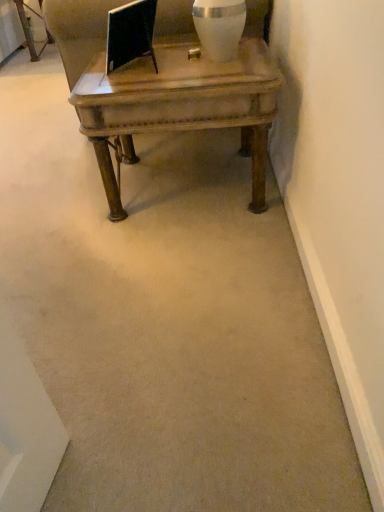
Find the location of `wooden coffee table at center`. wooden coffee table at center is located at coordinates (180, 105).

Describe the element at coordinates (180, 105) in the screenshot. I see `wooden coffee table at center` at that location.

Measure the distance between wooden coffee table at center and camera.

wooden coffee table at center is 1.33 meters away from camera.

The image size is (384, 512). Describe the element at coordinates (219, 27) in the screenshot. I see `white glossy vase at upper center` at that location.

The height and width of the screenshot is (512, 384). I want to click on white glossy vase at upper center, so click(219, 27).

Find the location of a particular element. Image resolution: width=384 pixels, height=512 pixels. wooden coffee table at center is located at coordinates (180, 105).

Visually, is white glossy vase at upper center positioned to the left or to the right of wooden coffee table at center?

Based on their positions, white glossy vase at upper center is located to the right of wooden coffee table at center.

Between white glossy vase at upper center and wooden coffee table at center, which one is positioned in front?

wooden coffee table at center is more forward.

Which is in front, point (208, 6) or point (179, 54)?

The point (208, 6) is in front.

From the picture: From the image's perspective, is white glossy vase at upper center over wooden coffee table at center?

Yes, from the image's perspective, white glossy vase at upper center is above wooden coffee table at center.

From a real-world perspective, is white glossy vase at upper center located beneath wooden coffee table at center?

Actually, white glossy vase at upper center is physically above wooden coffee table at center in the real world.

Is white glossy vase at upper center wider or thinner than wooden coffee table at center?

Considering their sizes, white glossy vase at upper center looks slimmer than wooden coffee table at center.

Who is taller, white glossy vase at upper center or wooden coffee table at center?

Standing taller between the two is wooden coffee table at center.

Between white glossy vase at upper center and wooden coffee table at center, which one has smaller size?

With smaller size is white glossy vase at upper center.

Is white glossy vase at upper center spatially inside wooden coffee table at center, or outside of it?

white glossy vase at upper center is located beyond the bounds of wooden coffee table at center.

Is white glossy vase at upper center next to wooden coffee table at center?

white glossy vase at upper center and wooden coffee table at center are not in contact.

Looking at this image, is white glossy vase at upper center oriented towards wooden coffee table at center?

No, white glossy vase at upper center is not oriented towards wooden coffee table at center.

Locate an element on the screen. vase behind the wooden coffee table at center is located at coordinates (219, 27).

Is wooden coffee table at center to the left of white glossy vase at upper center from the viewer's perspective?

Yes, wooden coffee table at center is to the left of white glossy vase at upper center.

Considering the relative positions of wooden coffee table at center and white glossy vase at upper center in the image provided, is wooden coffee table at center behind white glossy vase at upper center?

That is False.

Does point (145, 120) appear closer or farther from the camera than point (231, 23)?

Point (145, 120).

Looking at this image, from the image's perspective, is wooden coffee table at center located above or below white glossy vase at upper center?

Clearly, from the image's perspective, wooden coffee table at center is below white glossy vase at upper center.

From a real-world perspective, is wooden coffee table at center physically above white glossy vase at upper center?

Actually, wooden coffee table at center is physically below white glossy vase at upper center in the real world.

Is wooden coffee table at center thinner than white glossy vase at upper center?

In fact, wooden coffee table at center might be wider than white glossy vase at upper center.

Looking at this image, considering the relative sizes of wooden coffee table at center and white glossy vase at upper center in the image provided, is wooden coffee table at center taller than white glossy vase at upper center?

Indeed, wooden coffee table at center has a greater height compared to white glossy vase at upper center.

Which of these two, wooden coffee table at center or white glossy vase at upper center, is smaller?

white glossy vase at upper center.

Is wooden coffee table at center positioned beyond the bounds of white glossy vase at upper center?

Yes, wooden coffee table at center is outside of white glossy vase at upper center.

Are wooden coffee table at center and white glossy vase at upper center making contact?

No, wooden coffee table at center is not next to white glossy vase at upper center.

Is wooden coffee table at center aimed at white glossy vase at upper center?

No.

The image size is (384, 512). In the image, there is a white glossy vase at upper center. What are the coordinates of `coffee table below it (from the image's perspective)` in the screenshot? It's located at (180, 105).

The image size is (384, 512). I want to click on vase behind the wooden coffee table at center, so click(x=219, y=27).

Identify the location of vase lying above the wooden coffee table at center (from the image's perspective). (219, 27).